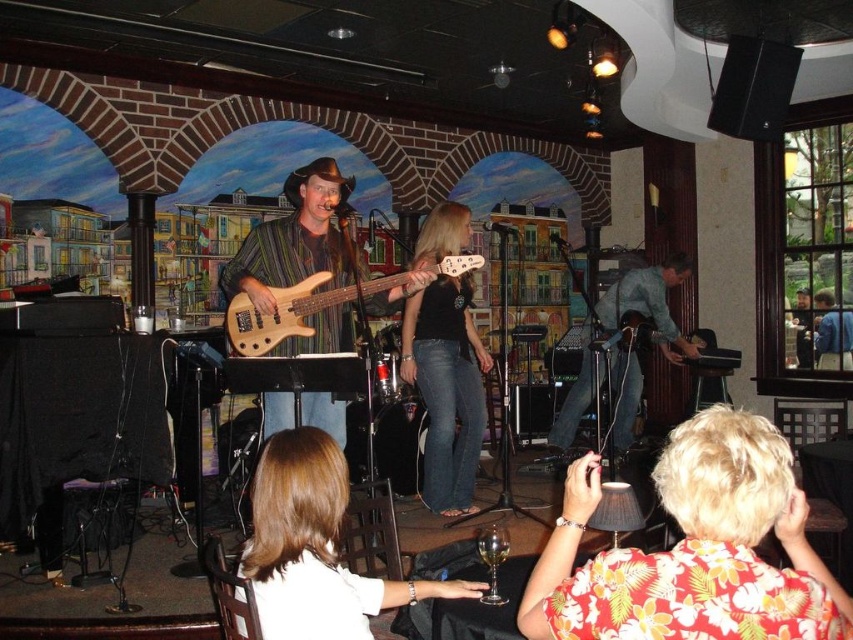
Question: Is the position of blonde hair at center less distant than that of blue denim jeans at center?

Choices:
 (A) no
 (B) yes

Answer: (B)

Question: Which point is farther to the camera?

Choices:
 (A) tap(264, 298)
 (B) tap(462, 336)

Answer: (B)

Question: Is floral print shirt at lower right smaller than blue denim jeans at center?

Choices:
 (A) yes
 (B) no

Answer: (A)

Question: Which is nearer to the wooden bass guitar at center?

Choices:
 (A) black denim jeans at center
 (B) blonde hair at center
 (C) blue denim jeans at center

Answer: (A)

Question: Is blonde hair at center below natural wood electric bass at center?

Choices:
 (A) yes
 (B) no

Answer: (A)

Question: Considering the real-world distances, which object is farthest from the floral print shirt at lower right?

Choices:
 (A) wooden bass guitar at center
 (B) blue denim jeans at center
 (C) black denim jeans at center

Answer: (B)